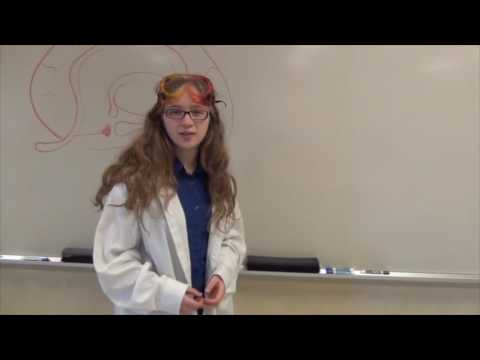
Locate an element on the screen. This screenshot has height=360, width=480. erasers is located at coordinates (290, 270).